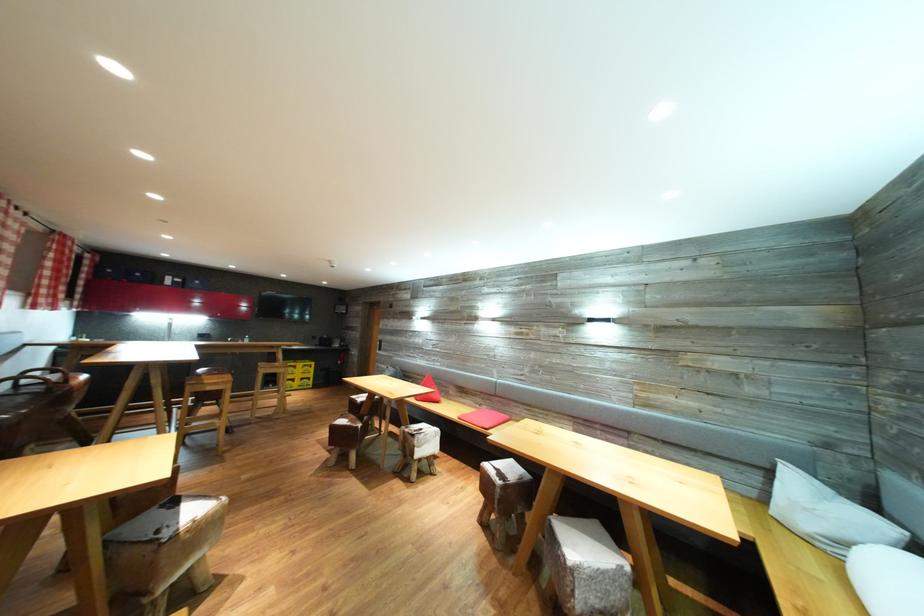
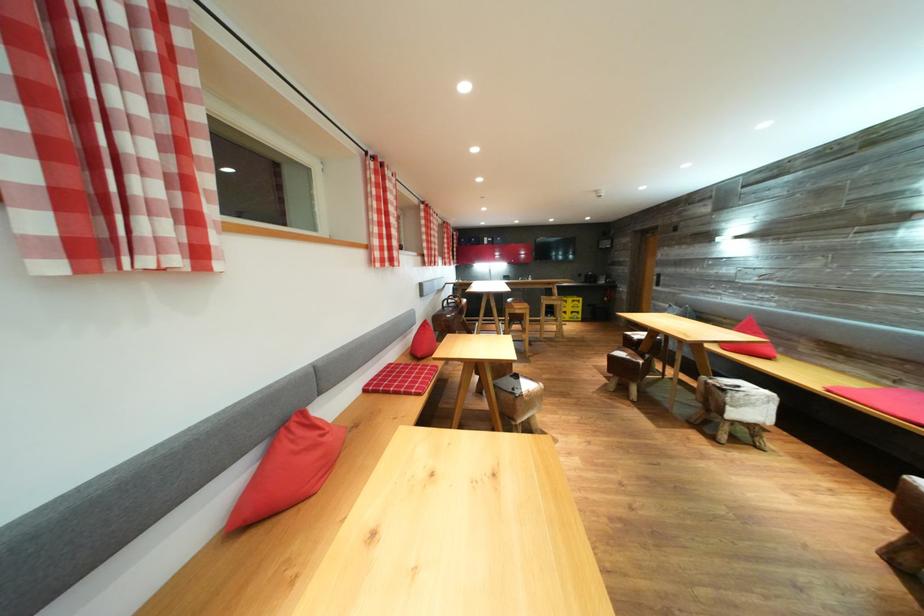
In the second image, find the point that corresponds to point (181, 541) in the first image.

(528, 400)